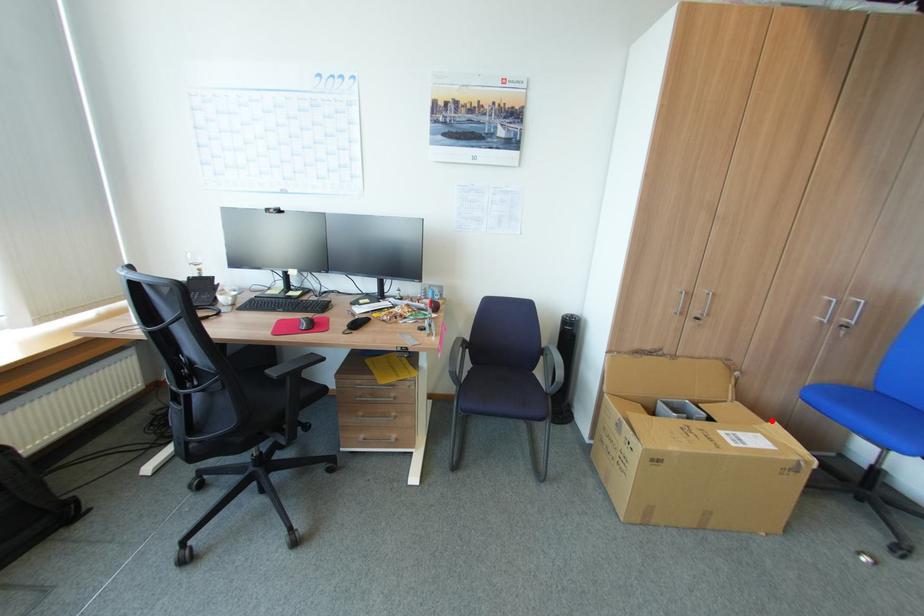
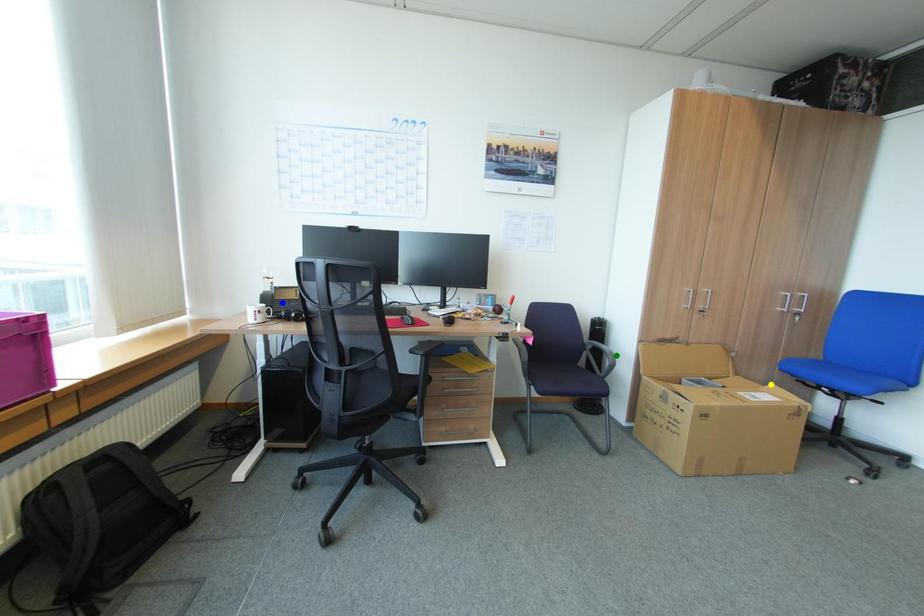
Question: I am providing you with two images of the same scene from different viewpoints. A red point is marked on the first image. You are given multiple points on the second image. Which point in image 2 is actually the same real-world point as the red point in image 1?

Choices:
 (A) green point
 (B) yellow point
 (C) blue point

Answer: (B)